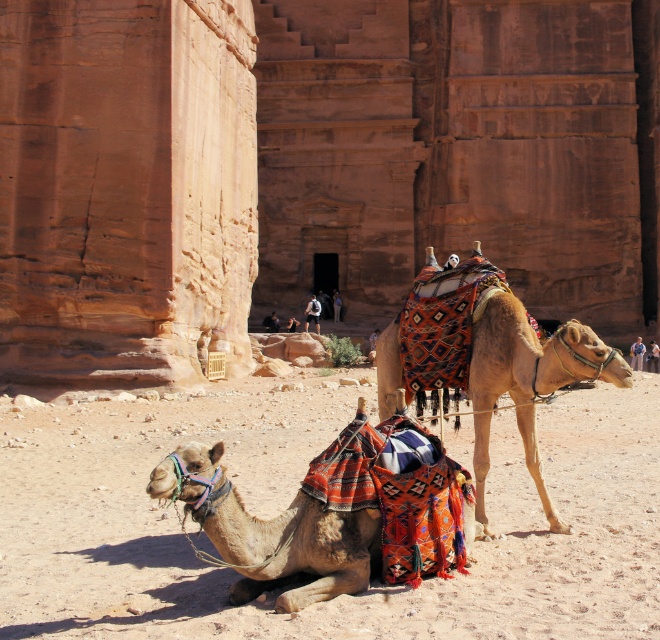
Is sandy beige sand at lower center smaller than multicolored fabric camel at lower left?

Actually, sandy beige sand at lower center might be larger than multicolored fabric camel at lower left.

Locate an element on the screen. The height and width of the screenshot is (640, 660). sandy beige sand at lower center is located at coordinates coord(290,499).

Is multicolored fabric camel at lower left wider than multicolored woven saddle at center?

Incorrect, multicolored fabric camel at lower left's width does not surpass multicolored woven saddle at center's.

Is multicolored fabric camel at lower left bigger than multicolored woven saddle at center?

No.

Does point (339, 468) come behind point (495, 360)?

No.

The width and height of the screenshot is (660, 640). I want to click on multicolored fabric camel at lower left, so click(333, 513).

Locate an element on the screen. sandy beige sand at lower center is located at coordinates (290, 499).

Is sandy beige sand at lower center thinner than multicolored woven saddle at center?

Incorrect, sandy beige sand at lower center's width is not less than multicolored woven saddle at center's.

You are a GUI agent. You are given a task and a screenshot of the screen. Output one action in this format:
    pyautogui.click(x=<x>, y=<y>)
    Task: Click on the sandy beige sand at lower center
    
    Given the screenshot: What is the action you would take?
    pyautogui.click(x=290, y=499)